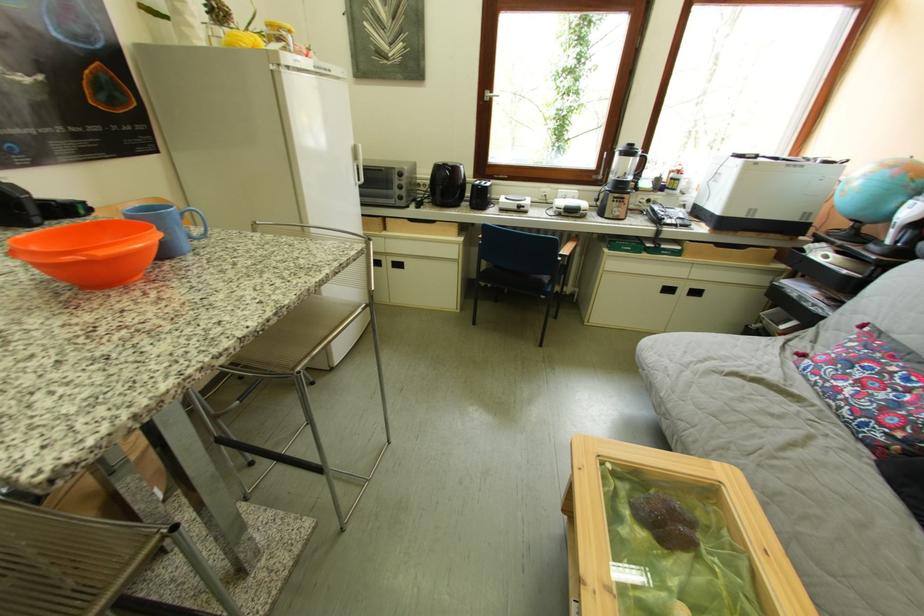
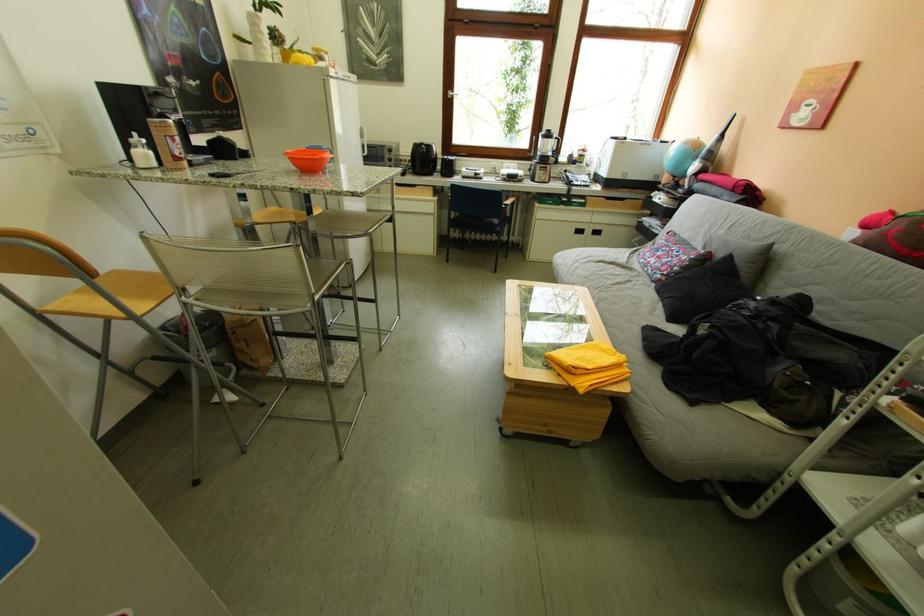
In the second image, find the point that corresponds to point (555, 300) in the first image.

(507, 238)